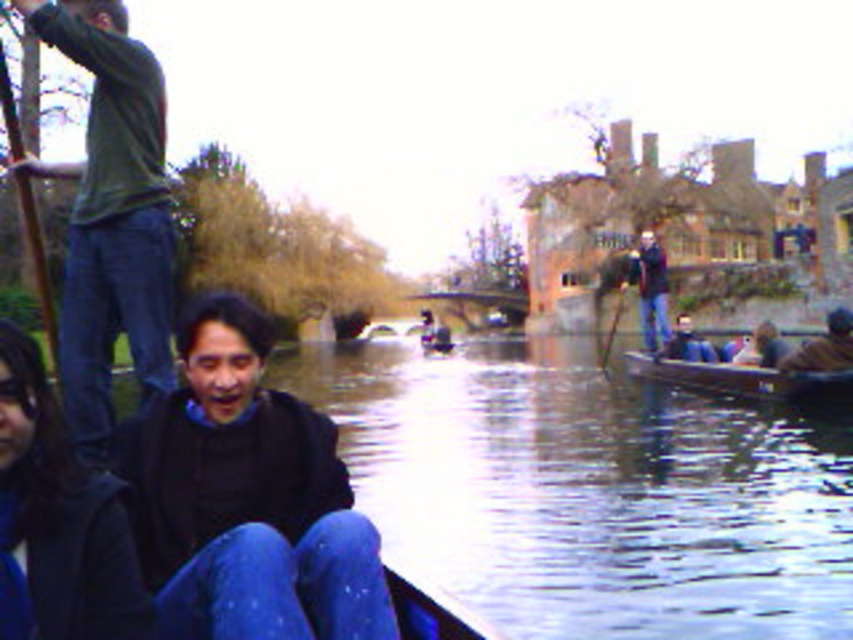
The width and height of the screenshot is (853, 640). In order to click on dark blue sweater at center in this screenshot , I will do `click(247, 499)`.

Is dark blue sweater at center to the left of wooden canoe at right from the viewer's perspective?

Correct, you'll find dark blue sweater at center to the left of wooden canoe at right.

Which is behind, point (196, 512) or point (811, 397)?

Point (811, 397)

Find the location of a particular element. This screenshot has height=640, width=853. dark blue sweater at center is located at coordinates (247, 499).

Is blue denim jeans at lower center to the right of dark blue jeans at center from the viewer's perspective?

Incorrect, blue denim jeans at lower center is not on the right side of dark blue jeans at center.

How distant is blue denim jeans at lower center from dark blue jeans at center?

blue denim jeans at lower center and dark blue jeans at center are 76.36 meters apart from each other.

Between point (13, 602) and point (650, 316), which one is positioned behind?

Point (650, 316)

I want to click on blue denim jeans at lower center, so click(x=57, y=520).

Consider the image. Between dark blue jeans at center and dark brown leather jacket at lower right, which one is positioned higher?

dark blue jeans at center is above.

Which is more to the left, dark blue jeans at center or dark brown leather jacket at lower right?

dark blue jeans at center is more to the left.

Who is more distant from viewer, (657, 294) or (795, 364)?

The point (657, 294) is more distant.

Find the location of `dark blue jeans at center`. dark blue jeans at center is located at coordinates (650, 289).